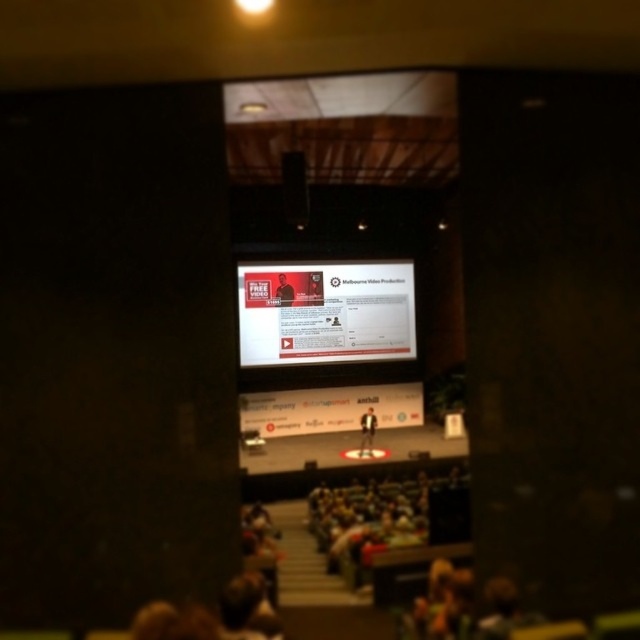
Question: Which point is farther from the camera taking this photo?

Choices:
 (A) (305, 182)
 (B) (381, 353)
 (C) (369, 445)

Answer: (B)

Question: Is matte white screen at center behind matte black speaker at center?

Choices:
 (A) no
 (B) yes

Answer: (B)

Question: Estimate the real-world distances between objects in this image. Which object is closer to the matte white screen at center?

Choices:
 (A) matte black suit at center
 (B) matte black speaker at center

Answer: (A)

Question: Does matte black speaker at center appear under dark suit at center?

Choices:
 (A) no
 (B) yes

Answer: (A)

Question: Can you confirm if matte white screen at center is smaller than dark suit at center?

Choices:
 (A) yes
 (B) no

Answer: (B)

Question: Which of these objects is positioned closest to the matte white screen at center?

Choices:
 (A) matte black suit at center
 (B) matte black speaker at center

Answer: (A)